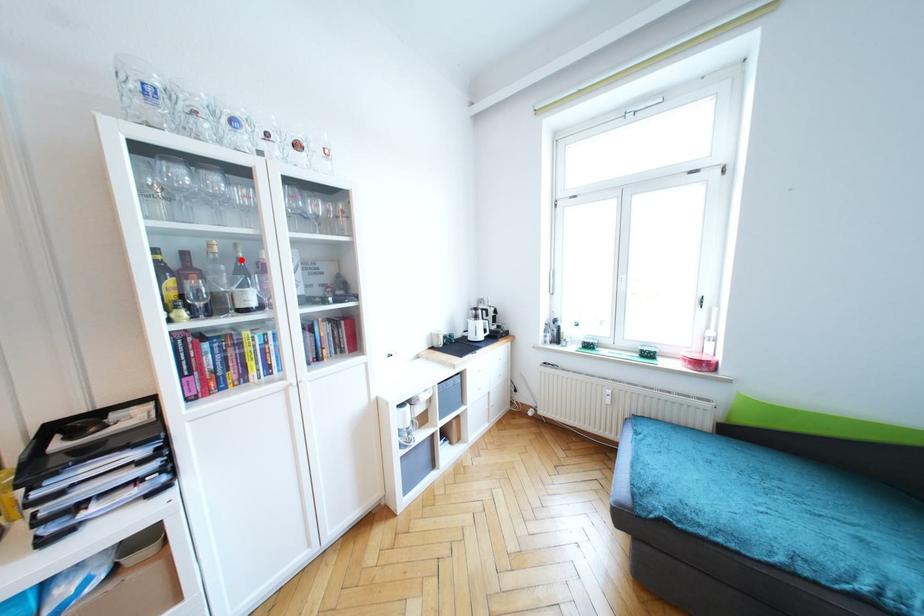
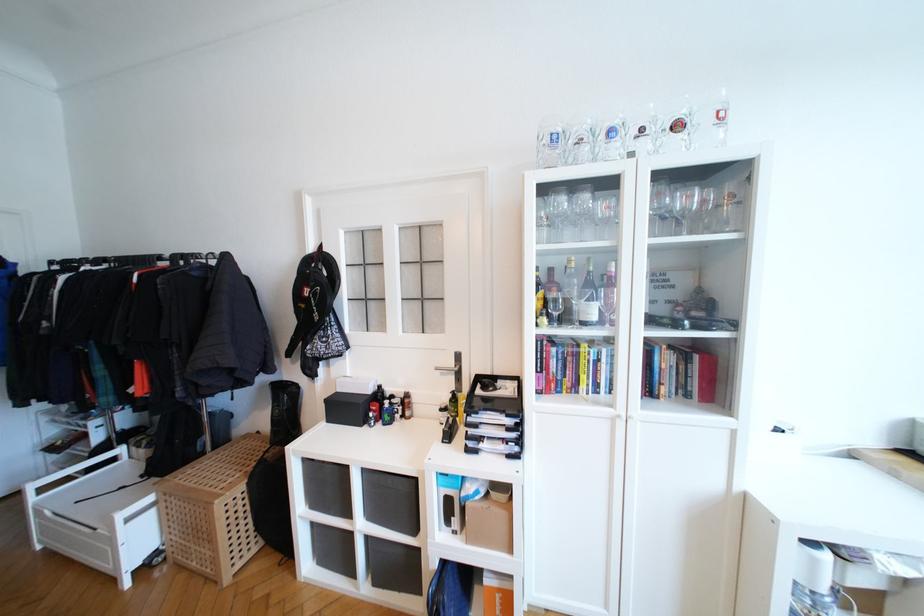
Where in the second image is the point corresponding to the highlighted location from the first image?

(591, 273)